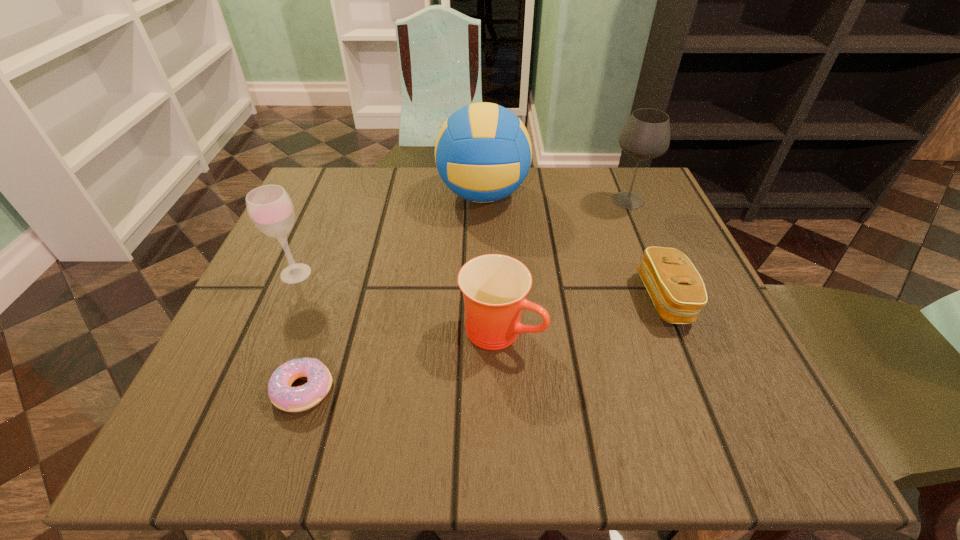
In order to click on doughnut located at the left edge in this screenshot , I will do `click(291, 399)`.

Identify the location of wineglass that is at the right edge. Image resolution: width=960 pixels, height=540 pixels. (646, 135).

This screenshot has height=540, width=960. Find the location of `clutch bag located in the right edge section of the desktop`. clutch bag located in the right edge section of the desktop is located at coordinates (677, 290).

Locate an element on the screen. This screenshot has width=960, height=540. object positioned at the near left corner is located at coordinates (291, 399).

Where is `object that is at the far right corner`? The height and width of the screenshot is (540, 960). object that is at the far right corner is located at coordinates (646, 135).

This screenshot has height=540, width=960. I want to click on vacant space at the far edge of the desktop, so click(532, 209).

The image size is (960, 540). Identify the location of vacant space at the near edge. (429, 406).

In the image, there is a desktop. At what (x,y) coordinates should I click in order to perform the action: click on vacant space at the left edge. Please return your answer as a coordinate pair (x, y). This screenshot has height=540, width=960. Looking at the image, I should click on (327, 279).

Identify the location of vacant space at the right edge of the desktop. This screenshot has width=960, height=540. (627, 229).

The image size is (960, 540). What are the coordinates of `free space at the far left corner of the desktop` in the screenshot? It's located at (340, 174).